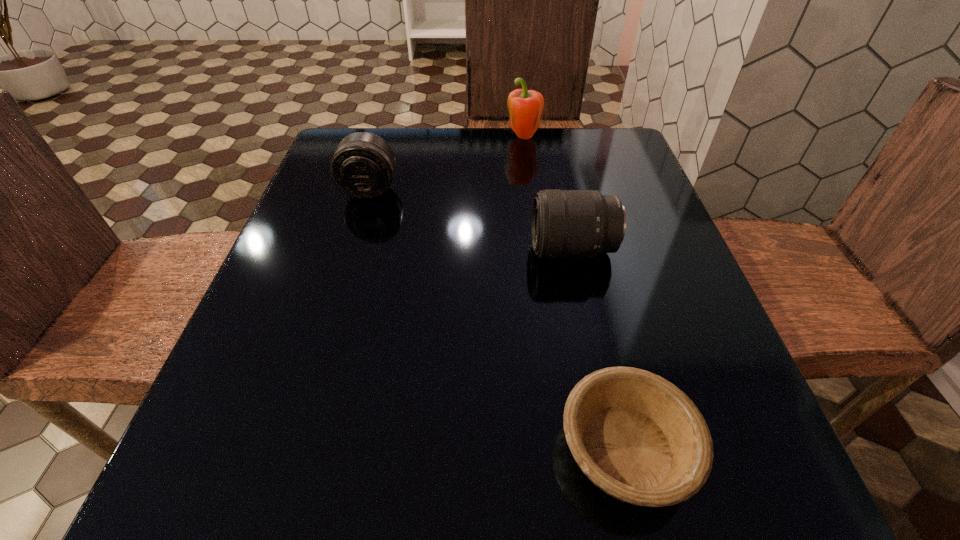
Where is `free space between the leftmost object and the pepper`? free space between the leftmost object and the pepper is located at coordinates (446, 164).

I want to click on free space between the nearest object and the tallest object, so click(575, 294).

The image size is (960, 540). Find the location of `free point between the farther telephoto lens and the tallest object`. free point between the farther telephoto lens and the tallest object is located at coordinates (446, 164).

The image size is (960, 540). I want to click on empty location between the bowl and the second nearest object, so [599, 349].

Identify the location of the third closest object relative to the bowl. (525, 106).

You are a GUI agent. You are given a task and a screenshot of the screen. Output one action in this format:
    pyautogui.click(x=<x>, y=<y>)
    Task: Click on the object that is the third closest one to the bowl
    
    Given the screenshot: What is the action you would take?
    pyautogui.click(x=525, y=106)

Where is `vacant area in the image that satisfies the following two spatial constraints: 1. on the front-facing side of the bowl; 2. on the right side of the third nearest object`? The height and width of the screenshot is (540, 960). vacant area in the image that satisfies the following two spatial constraints: 1. on the front-facing side of the bowl; 2. on the right side of the third nearest object is located at coordinates (293, 448).

Locate an element on the screen. The image size is (960, 540). vacant space that satisfies the following two spatial constraints: 1. on the back side of the shortest object; 2. on the surface of the right telephoto lens is located at coordinates (580, 249).

Find the location of a particular element. The height and width of the screenshot is (540, 960). free space in the image that satisfies the following two spatial constraints: 1. on the back side of the nearest object; 2. on the surface of the nearer telephoto lens is located at coordinates (580, 249).

I want to click on vacant space that satisfies the following two spatial constraints: 1. on the back side of the shortest object; 2. on the surface of the nearer telephoto lens, so pos(580,249).